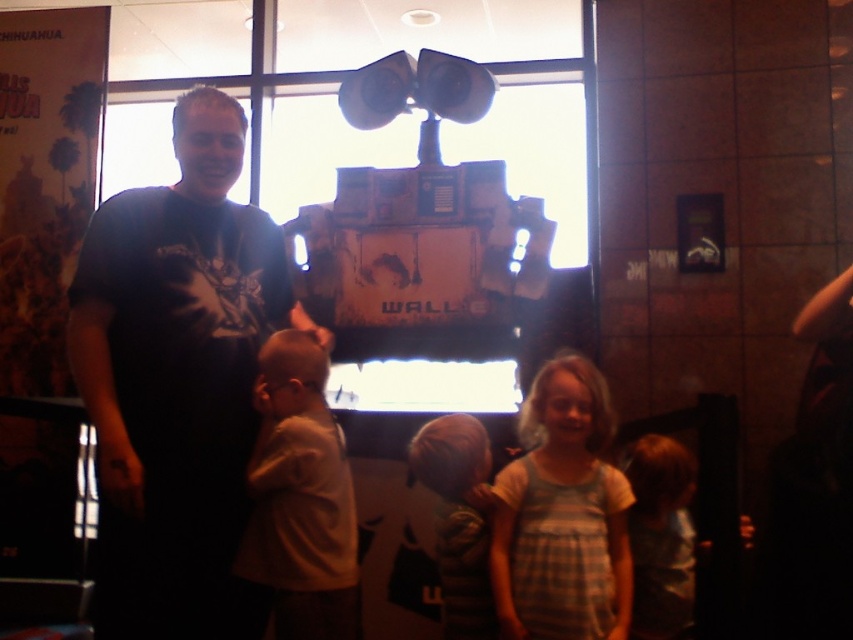
You are attending a movie premiere and want to take a photo of the crowd. You notice the plaid fabric dress at center and the striped fabric shirt at center. Which one is closer to the camera?

The plaid fabric dress at center is closer to the camera because it is in front of the striped fabric shirt at center.

You are attending a movie premiere and notice two attendees wearing a plaid fabric dress at center and a striped fabric shirt at center. Which attendee is standing to the right of the other?

The plaid fabric dress at center is positioned on the right side of striped fabric shirt at center, so the attendee wearing the plaid fabric dress at center is standing to the right of the one wearing the striped fabric shirt at center.

You are standing in the movie theater and want to take a photo of the two points on the screen. Which point, point (154, 412) or point (312, 576), is closer to you?

Point (154, 412) is closer to the camera than point (312, 576), so it is closer to you.